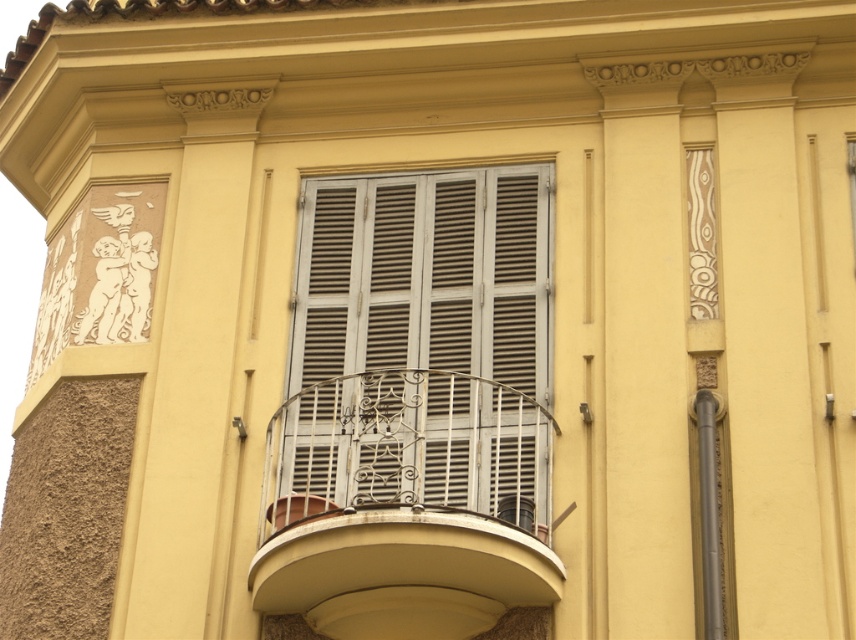
You are standing in front of the building and notice the white matte shutters at center and the white metal balcony at center. Which object is positioned higher relative to the other?

The white matte shutters at center are positioned above the white metal balcony at center, so the white matte shutters at center is higher.

You are an architect reviewing the building design. You see the white matte shutters at center and the white metal balcony at center. Which object is located to the right of the other?

The white matte shutters at center is positioned on the right side of white metal balcony at center, so the shutters are to the right of the balcony.